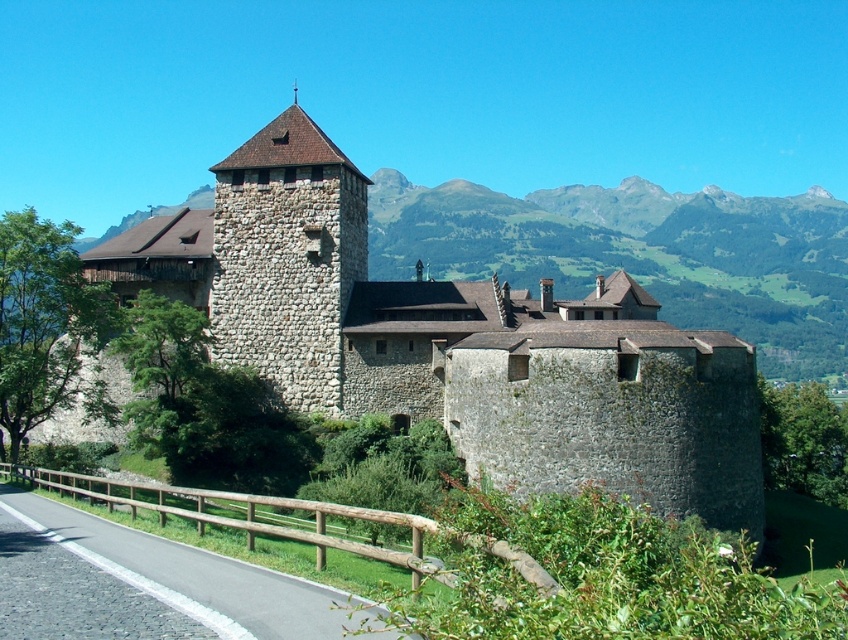
Based on the photo, you are a visitor approaching the castle along the paved road. You notice the stone wall at center and the stone tower at center. Which one do you see first as you walk towards the castle?

The stone wall at center is in front of the stone tower at center, so you will see the stone wall at center first as you approach the castle.

You are a medieval architect designing a new pathway that must fit between the stone wall at center and the stone tower at center. Based on the scene, can you determine if the space between them is wide enough for a 2 meter wide path?

The stone wall at center might be wider than the stone tower at center, but without exact measurements, it is uncertain whether the space between them can accommodate a 2 meter wide path. Further measurements or clarification are needed.